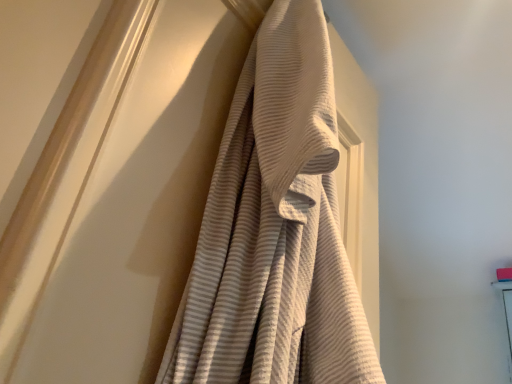
Find the location of a particular element. The width and height of the screenshot is (512, 384). beige striped towel at center is located at coordinates (275, 229).

Describe the element at coordinates (275, 229) in the screenshot. I see `beige striped towel at center` at that location.

Identify the location of beige striped towel at center. This screenshot has width=512, height=384. (275, 229).